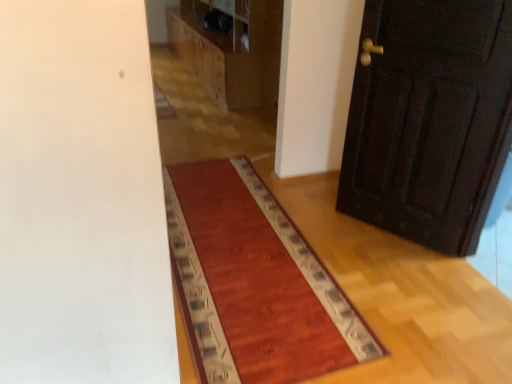
Question: Visually, is dark wood door at right positioned to the left or to the right of wooden dresser at upper center?

Choices:
 (A) left
 (B) right

Answer: (B)

Question: In terms of width, does dark wood door at right look wider or thinner when compared to wooden dresser at upper center?

Choices:
 (A) thin
 (B) wide

Answer: (A)

Question: Which of these objects is positioned farthest from the wooden dresser at upper center?

Choices:
 (A) dark wood door at right
 (B) rug with patterned border at center

Answer: (B)

Question: Which of these objects is positioned farthest from the dark wood door at right?

Choices:
 (A) rug with patterned border at center
 (B) wooden dresser at upper center

Answer: (B)